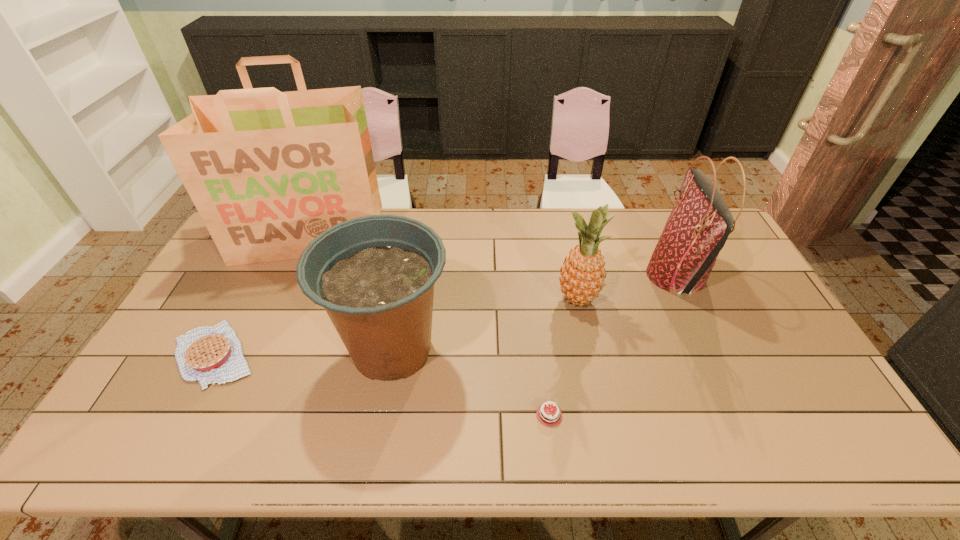
Where is `grocery bag`? The image size is (960, 540). grocery bag is located at coordinates (268, 171).

The image size is (960, 540). Find the location of `the rightmost object`. the rightmost object is located at coordinates (700, 222).

I want to click on pineapple, so click(x=582, y=277).

Locate an element on the screen. flowerpot is located at coordinates (374, 275).

Locate an element on the screen. Image resolution: width=960 pixels, height=540 pixels. the fifth tallest object is located at coordinates (213, 355).

The height and width of the screenshot is (540, 960). I want to click on the shortest object, so click(x=551, y=417).

This screenshot has height=540, width=960. I want to click on vacant space located 0.170m on the front of the tallest object, so click(x=279, y=305).

Where is `free location located on the left of the rightmost object`? free location located on the left of the rightmost object is located at coordinates (616, 276).

This screenshot has width=960, height=540. Identify the location of free space located 0.380m on the right of the pineapple. (723, 299).

Locate an element on the screen. The width and height of the screenshot is (960, 540). free space located 0.230m on the back of the flowerpot is located at coordinates (409, 255).